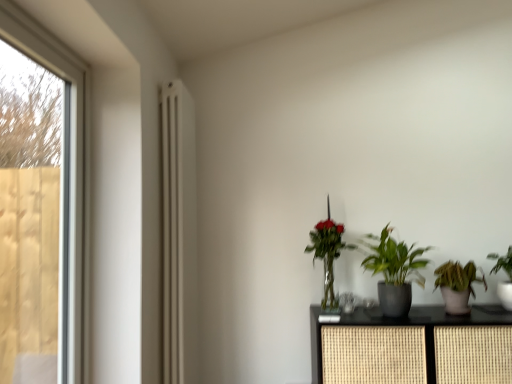
Question: Considering the relative sizes of green matte plant at center, placed as the 2th houseplant when sorted from left to right, and green leafy plant at right, the first houseplant when ordered from right to left, in the image provided, is green matte plant at center, placed as the 2th houseplant when sorted from left to right, taller than green leafy plant at right, the first houseplant when ordered from right to left,?

Choices:
 (A) yes
 (B) no

Answer: (A)

Question: Is green matte plant at center, which is counted as the third houseplant, starting from the right, turned away from green leafy plant at right, the first houseplant when ordered from right to left?

Choices:
 (A) yes
 (B) no

Answer: (B)

Question: From a real-world perspective, is green matte plant at center, which is counted as the third houseplant, starting from the right, below green leafy plant at right, the first houseplant when ordered from right to left?

Choices:
 (A) yes
 (B) no

Answer: (B)

Question: Is green matte plant at center, placed as the 2th houseplant when sorted from left to right, positioned in front of green leafy plant at right, the first houseplant when ordered from right to left?

Choices:
 (A) no
 (B) yes

Answer: (B)

Question: Does green matte plant at center, which is counted as the third houseplant, starting from the right, appear on the left side of green leafy plant at right, the first houseplant when ordered from right to left?

Choices:
 (A) no
 (B) yes

Answer: (B)

Question: Does green matte plant at center, placed as the 2th houseplant when sorted from left to right, turn towards green leafy plant at right, which is counted as the 4th houseplant, starting from the left?

Choices:
 (A) no
 (B) yes

Answer: (A)

Question: Considering the relative sizes of green matte plant at center, which is counted as the third houseplant, starting from the right, and green matte houseplant at lower right, which ranks as the 3th houseplant in left-to-right order, in the image provided, is green matte plant at center, which is counted as the third houseplant, starting from the right, bigger than green matte houseplant at lower right, which ranks as the 3th houseplant in left-to-right order,?

Choices:
 (A) no
 (B) yes

Answer: (B)

Question: Is green matte plant at center, which is counted as the third houseplant, starting from the right, at the left side of green matte houseplant at lower right, which ranks as the 3th houseplant in left-to-right order?

Choices:
 (A) yes
 (B) no

Answer: (A)

Question: From the image's perspective, would you say green matte plant at center, which is counted as the third houseplant, starting from the right, is positioned over green matte houseplant at lower right, which ranks as the 3th houseplant in left-to-right order?

Choices:
 (A) yes
 (B) no

Answer: (A)

Question: Does green matte plant at center, which is counted as the third houseplant, starting from the right, appear on the right side of green matte houseplant at lower right, which ranks as the 3th houseplant in left-to-right order?

Choices:
 (A) no
 (B) yes

Answer: (A)

Question: Does green matte plant at center, placed as the 2th houseplant when sorted from left to right, have a greater height compared to green matte houseplant at lower right, which ranks as the 3th houseplant in left-to-right order?

Choices:
 (A) yes
 (B) no

Answer: (A)

Question: Can you confirm if green matte plant at center, placed as the 2th houseplant when sorted from left to right, is thinner than green matte houseplant at lower right, positioned as the second houseplant in right-to-left order?

Choices:
 (A) yes
 (B) no

Answer: (A)

Question: Does green leafy plant at right, the first houseplant when ordered from right to left, come behind matte white radiator at left?

Choices:
 (A) no
 (B) yes

Answer: (B)